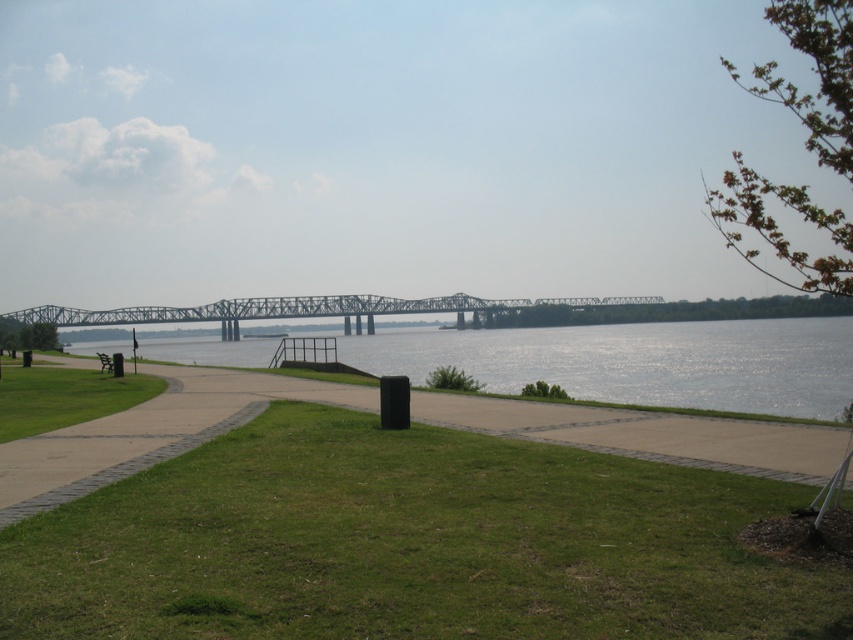
Which is behind, point (149, 516) or point (645, 332)?

Point (645, 332)

Is green grass at center smaller than green water at center?

Indeed, green grass at center has a smaller size compared to green water at center.

The height and width of the screenshot is (640, 853). Identify the location of green grass at center. (410, 544).

Can you confirm if green water at center is taller than metallic gray bridge at center?

In fact, green water at center may be shorter than metallic gray bridge at center.

Based on the photo, does green water at center have a larger size compared to metallic gray bridge at center?

Indeed, green water at center has a larger size compared to metallic gray bridge at center.

Who is more forward, (720,337) or (381,304)?

Point (720,337) is more forward.

Find the location of a particular element. The image size is (853, 640). green water at center is located at coordinates (640, 362).

Looking at this image, can you confirm if green water at center is positioned to the right of brown wooden park bench at lower left?

Correct, you'll find green water at center to the right of brown wooden park bench at lower left.

Is green water at center bigger than brown wooden park bench at lower left?

Correct, green water at center is larger in size than brown wooden park bench at lower left.

You are a GUI agent. You are given a task and a screenshot of the screen. Output one action in this format:
    pyautogui.click(x=<x>, y=<y>)
    Task: Click on the green water at center
    
    Given the screenshot: What is the action you would take?
    pyautogui.click(x=640, y=362)